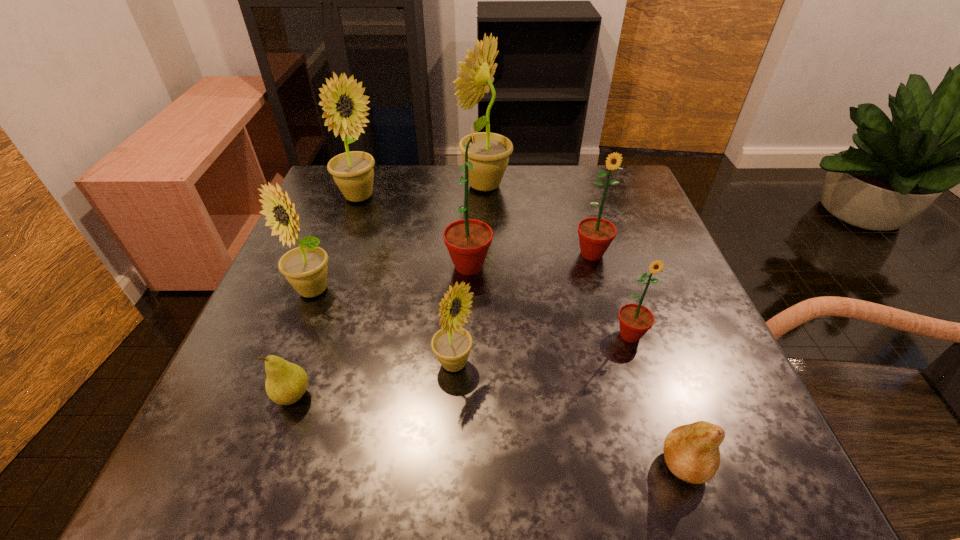
At what (x,y) coordinates should I click in order to perform the action: click on the nearest object. Please return your answer as a coordinate pair (x, y). The image size is (960, 540). Looking at the image, I should click on (691, 452).

Locate an element on the screen. free point located 0.360m on the face of the biggest yellow sunflower is located at coordinates (319, 185).

This screenshot has width=960, height=540. Find the location of `free space located on the face of the biggest yellow sunflower`. free space located on the face of the biggest yellow sunflower is located at coordinates (384, 185).

Find the location of a particular element. vacant space located 0.080m on the face of the biggest yellow sunflower is located at coordinates (427, 185).

Where is `vacant space positioned on the face of the third smallest yellow sunflower`? vacant space positioned on the face of the third smallest yellow sunflower is located at coordinates (402, 198).

The image size is (960, 540). What are the coordinates of `vacant space located 0.370m on the face of the biggest green sunflower` in the screenshot? It's located at (672, 266).

Locate an element on the screen. free location located on the face of the second biggest green sunflower is located at coordinates coord(614,334).

Locate an element on the screen. free space located on the face of the second nearest yellow sunflower is located at coordinates click(248, 454).

What are the coordinates of `vacant area situated on the face of the nearest yellow sunflower` in the screenshot? It's located at (535, 364).

Locate an element on the screen. Image resolution: width=960 pixels, height=540 pixels. free space located 0.080m on the face of the smallest green sunflower is located at coordinates (647, 389).